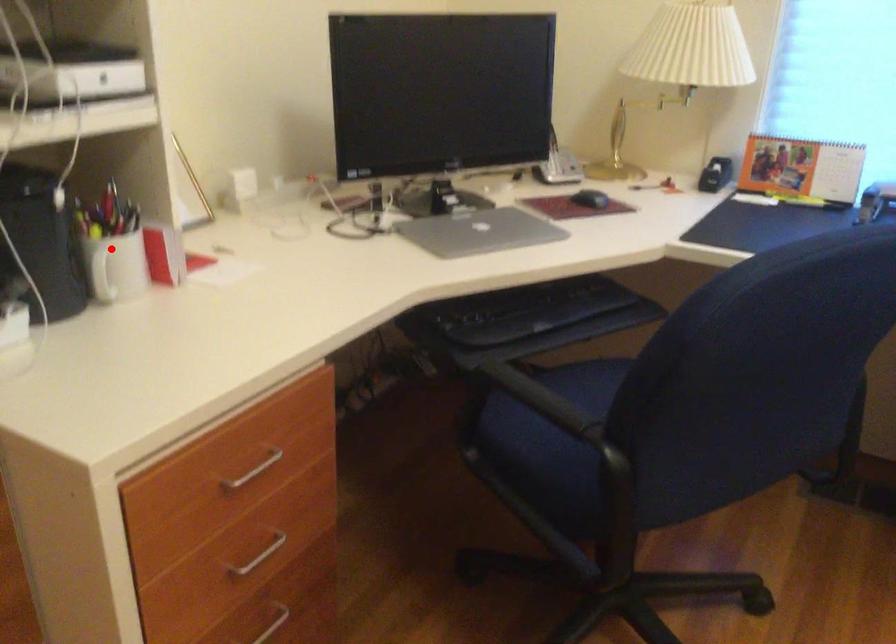
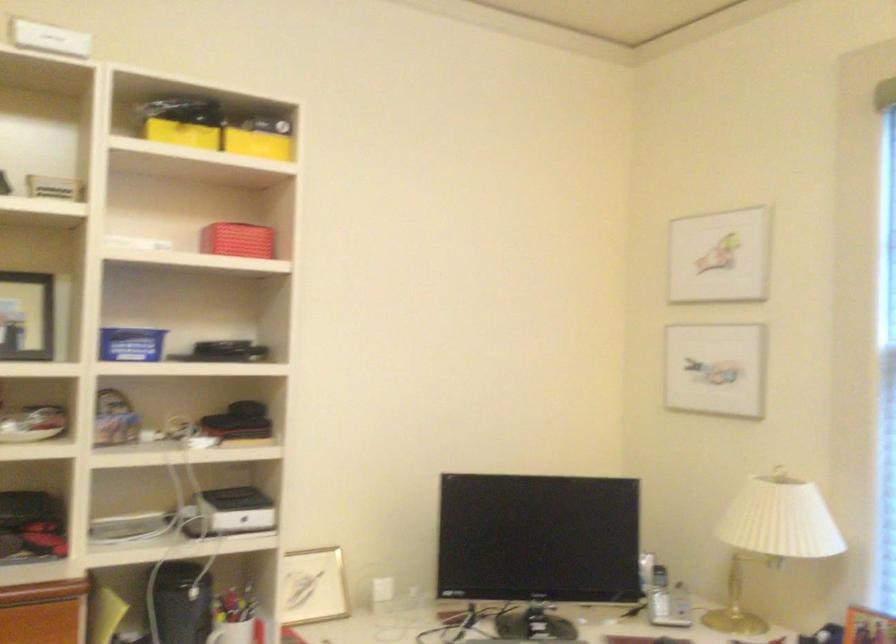
The point at the highlighted location is marked in the first image. Where is the corresponding point in the second image?

(231, 632)